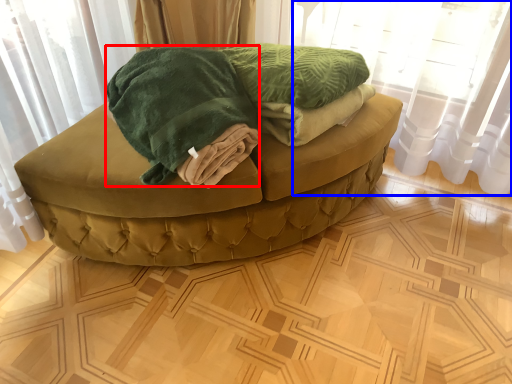
Question: Which object is further to the camera taking this photo, cloth (highlighted by a red box) or curtain (highlighted by a blue box)?

Choices:
 (A) cloth
 (B) curtain

Answer: (B)